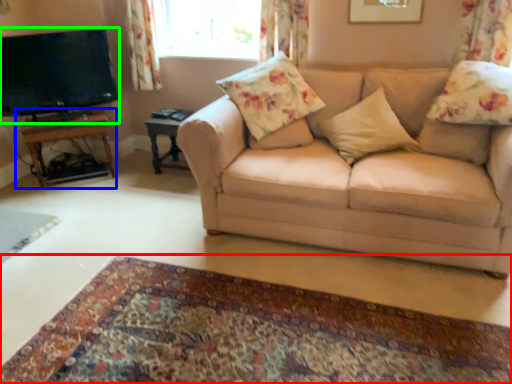
Question: Which object is positioned closest to plain (highlighted by a red box)? Select from table (highlighted by a blue box) and television (highlighted by a green box).

Choices:
 (A) table
 (B) television

Answer: (A)